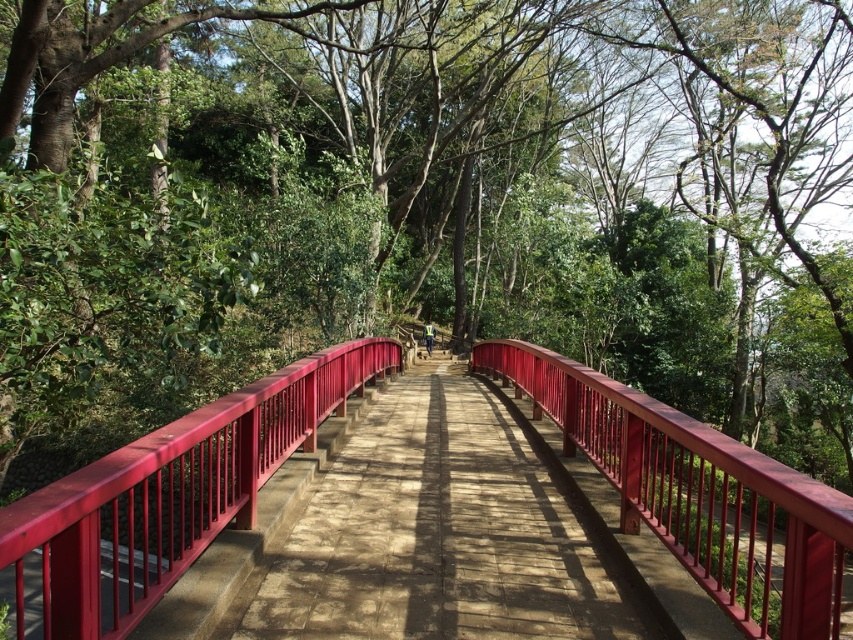
Does smooth wooden bridge at center have a larger size compared to matte red bridge at center?

No.

You are a GUI agent. You are given a task and a screenshot of the screen. Output one action in this format:
    pyautogui.click(x=<x>, y=<y>)
    Task: Click on the smooth wooden bridge at center
    This screenshot has width=853, height=640.
    Given the screenshot: What is the action you would take?
    pyautogui.click(x=438, y=536)

Describe the element at coordinates (438, 536) in the screenshot. This screenshot has width=853, height=640. I see `smooth wooden bridge at center` at that location.

Image resolution: width=853 pixels, height=640 pixels. What are the coordinates of `smooth wooden bridge at center` in the screenshot? It's located at (438, 536).

Does smooth wooden bridge at center appear over glossy wood rail at center?

Yes.

Is point (402, 408) more distant than point (663, 440)?

Yes.

Does point (454, 381) lie behind point (786, 502)?

Yes, point (454, 381) is behind point (786, 502).

The height and width of the screenshot is (640, 853). I want to click on smooth wooden bridge at center, so click(x=438, y=536).

Does matte red bridge at center have a greater width compared to glossy wood rail at center?

No.

Between matte red bridge at center and glossy wood rail at center, which one appears on the right side from the viewer's perspective?

glossy wood rail at center is more to the right.

Is point (76, 476) farther from camera compared to point (682, 452)?

No.

Where is `matte red bridge at center`? matte red bridge at center is located at coordinates (166, 497).